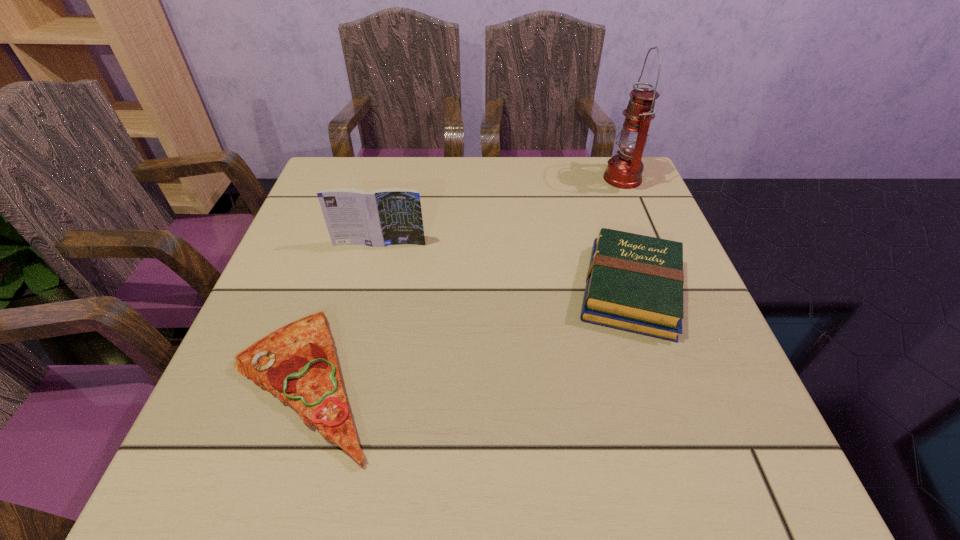
At what (x,y) coordinates should I click in order to perform the action: click on free region located on the right of the pizza. Please return your answer as a coordinate pair (x, y). The image size is (960, 540). Looking at the image, I should click on (500, 382).

Where is `object positioned at the far edge`? This screenshot has height=540, width=960. object positioned at the far edge is located at coordinates (x=624, y=170).

Where is `object located at the near edge`? This screenshot has width=960, height=540. object located at the near edge is located at coordinates (297, 363).

The image size is (960, 540). Find the location of `book positioned at the left edge`. book positioned at the left edge is located at coordinates (391, 216).

Where is `pizza at the left edge`? Image resolution: width=960 pixels, height=540 pixels. pizza at the left edge is located at coordinates (297, 363).

The image size is (960, 540). In order to click on oil lamp present at the right edge in this screenshot , I will do point(624,170).

Find the location of a particular element. The height and width of the screenshot is (540, 960). book located in the right edge section of the desktop is located at coordinates (634, 283).

I want to click on object that is positioned at the near left corner, so click(297, 363).

The image size is (960, 540). In order to click on object located in the far right corner section of the desktop in this screenshot , I will do `click(624, 170)`.

Image resolution: width=960 pixels, height=540 pixels. In order to click on free location at the far edge of the desktop in this screenshot , I will do pyautogui.click(x=440, y=187).